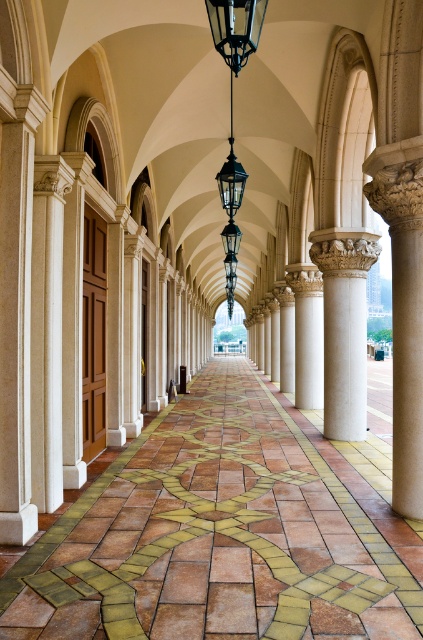
Question: Is brown tile floor at center smaller than white marble column at center?

Choices:
 (A) no
 (B) yes

Answer: (A)

Question: Among these objects, which one is farthest from the camera?

Choices:
 (A) white stone column at center
 (B) brown tile floor at center
 (C) white marble column at center
 (D) black metal lantern at upper center

Answer: (C)

Question: Is white stone column at center thinner than black metal lantern at upper center?

Choices:
 (A) no
 (B) yes

Answer: (A)

Question: Among these objects, which one is farthest from the camera?

Choices:
 (A) black metal lantern at upper center
 (B) white marble column at center
 (C) white stone column at center
 (D) brown tile floor at center

Answer: (B)

Question: From the image, what is the correct spatial relationship of brown tile floor at center in relation to black metal lantern at upper center?

Choices:
 (A) left
 (B) right

Answer: (B)

Question: Among these points, which one is nearest to the camera?

Choices:
 (A) (313, 442)
 (B) (255, 17)
 (C) (335, 355)

Answer: (B)